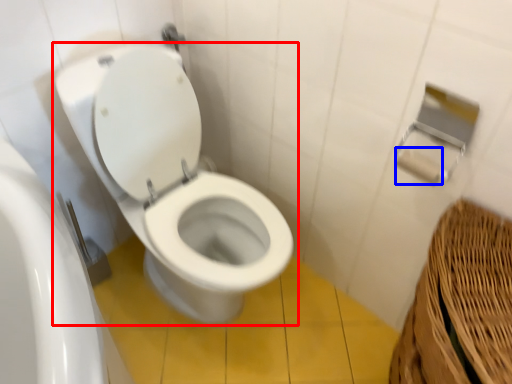
Question: Which object appears closest to the camera in this image, toilet (highlighted by a red box) or toilet paper (highlighted by a blue box)?

Choices:
 (A) toilet
 (B) toilet paper

Answer: (A)